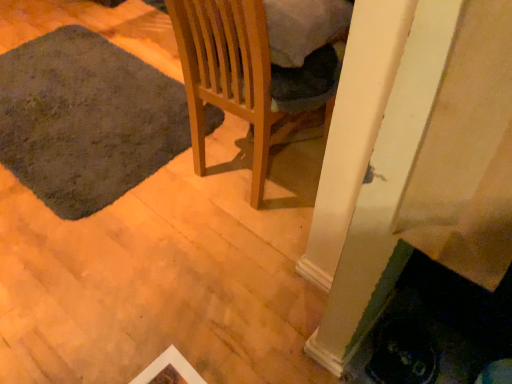
What do you see at coordinates (86, 120) in the screenshot?
I see `dark gray carpet at lower left` at bounding box center [86, 120].

You are a GUI agent. You are given a task and a screenshot of the screen. Output one action in this format:
    pyautogui.click(x=<x>, y=<y>)
    Task: Click on the dark gray carpet at lower left
    This screenshot has width=512, height=384.
    Given the screenshot: What is the action you would take?
    pyautogui.click(x=86, y=120)

Consider the image. Measure the distance between point (x=94, y=97) and camera.

1.91 meters.

Identify the location of wooden chair at center. (230, 75).

What do you see at coordinates (230, 75) in the screenshot? I see `wooden chair at center` at bounding box center [230, 75].

Image resolution: width=512 pixels, height=384 pixels. Find the location of `dark gray carpet at lower left`. dark gray carpet at lower left is located at coordinates (86, 120).

In the image, is wooden chair at center on the left side or the right side of dark gray carpet at lower left?

In the image, wooden chair at center appears on the right side of dark gray carpet at lower left.

Considering the positions of objects wooden chair at center and dark gray carpet at lower left in the image provided, who is behind, wooden chair at center or dark gray carpet at lower left?

dark gray carpet at lower left is more distant.

Considering the positions of points (239, 15) and (8, 101), is point (239, 15) farther from camera compared to point (8, 101)?

No, it is in front of (8, 101).

From the image's perspective, which is below, wooden chair at center or dark gray carpet at lower left?

From the image's view, wooden chair at center is below.

In the scene shown: From a real-world perspective, is wooden chair at center above or below dark gray carpet at lower left?

In terms of real-world spatial position, wooden chair at center is above dark gray carpet at lower left.

From the picture: Which object is thinner, wooden chair at center or dark gray carpet at lower left?

wooden chair at center.

Considering the sizes of objects wooden chair at center and dark gray carpet at lower left in the image provided, who is shorter, wooden chair at center or dark gray carpet at lower left?

Standing shorter between the two is dark gray carpet at lower left.

Considering the relative sizes of wooden chair at center and dark gray carpet at lower left in the image provided, is wooden chair at center smaller than dark gray carpet at lower left?

No.

Is wooden chair at center positioned beyond the bounds of dark gray carpet at lower left?

wooden chair at center lies outside dark gray carpet at lower left's area.

Is wooden chair at center placed right next to dark gray carpet at lower left?

No.

Is wooden chair at center aimed at dark gray carpet at lower left?

No, wooden chair at center is not oriented towards dark gray carpet at lower left.

Looking at this image, how many degrees apart are the facing directions of wooden chair at center and dark gray carpet at lower left?

wooden chair at center and dark gray carpet at lower left are facing 5.27 degrees away from each other.

Locate an element on the screen. This screenshot has width=512, height=384. mat that is on the left side of wooden chair at center is located at coordinates (86, 120).

Is dark gray carpet at lower left to the left of wooden chair at center from the viewer's perspective?

Correct, you'll find dark gray carpet at lower left to the left of wooden chair at center.

Relative to wooden chair at center, is dark gray carpet at lower left in front or behind?

Visually, dark gray carpet at lower left is located behind wooden chair at center.

Considering the positions of points (47, 60) and (210, 53), is point (47, 60) closer to camera compared to point (210, 53)?

That is False.

From the image's perspective, is dark gray carpet at lower left over wooden chair at center?

Yes, from the image's perspective, dark gray carpet at lower left is above wooden chair at center.

From a real-world perspective, is dark gray carpet at lower left positioned under wooden chair at center based on gravity?

Correct, in the physical world, dark gray carpet at lower left is lower than wooden chair at center.

Is dark gray carpet at lower left thinner than wooden chair at center?

In fact, dark gray carpet at lower left might be wider than wooden chair at center.

Who is shorter, dark gray carpet at lower left or wooden chair at center?

With less height is dark gray carpet at lower left.

Considering the sizes of objects dark gray carpet at lower left and wooden chair at center in the image provided, who is bigger, dark gray carpet at lower left or wooden chair at center?

Bigger between the two is wooden chair at center.

Can we say dark gray carpet at lower left lies outside wooden chair at center?

Yes, dark gray carpet at lower left is outside of wooden chair at center.

Is dark gray carpet at lower left directly adjacent to wooden chair at center?

No.

Is wooden chair at center at the back of dark gray carpet at lower left?

Answer: No.

How different are the orientations of dark gray carpet at lower left and wooden chair at center in degrees?

They differ by 5.27 degrees in their facing directions.

How far apart are dark gray carpet at lower left and wooden chair at center?

They are 22.55 inches apart.

I want to click on mat behind the wooden chair at center, so click(86, 120).

Image resolution: width=512 pixels, height=384 pixels. Find the location of `chair that appears above the dark gray carpet at lower left (from a real-world perspective)`. chair that appears above the dark gray carpet at lower left (from a real-world perspective) is located at coordinates (230, 75).

This screenshot has height=384, width=512. In the image, there is a dark gray carpet at lower left. What are the coordinates of `chair below it (from the image's perspective)` in the screenshot? It's located at (230, 75).